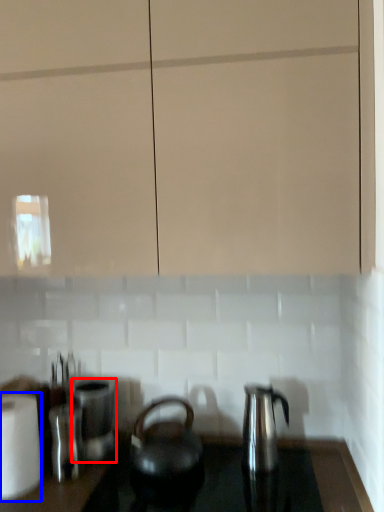
Question: Which point is closer to the camera, appliance (highlighted by a red box) or kitchen appliance (highlighted by a blue box)?

Choices:
 (A) appliance
 (B) kitchen appliance

Answer: (B)